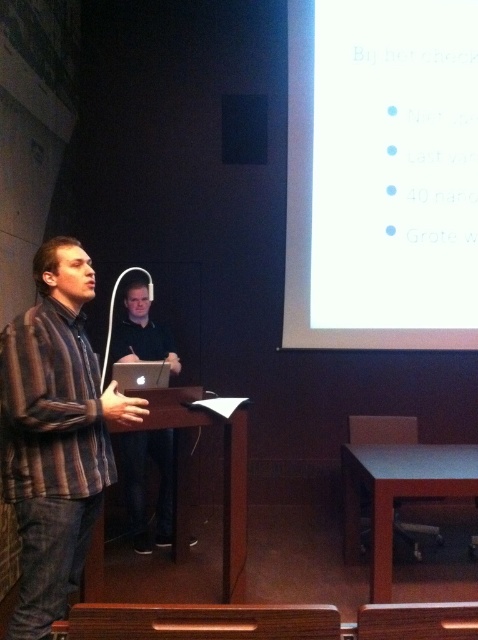
Does brown striped shirt at left have a greater height compared to matte black laptop at center?

Correct, brown striped shirt at left is much taller as matte black laptop at center.

Which is behind, point (107, 400) or point (140, 328)?

The point (140, 328) is behind.

Does point (61, 358) come closer to viewer compared to point (142, 451)?

That is True.

This screenshot has width=478, height=640. I want to click on brown striped shirt at left, so click(54, 433).

Can you confirm if white glossy projection screen at upper right is shorter than brown striped shirt at left?

No, white glossy projection screen at upper right is not shorter than brown striped shirt at left.

Is the position of white glossy projection screen at upper right more distant than that of brown striped shirt at left?

That is True.

What do you see at coordinates (381, 173) in the screenshot? The height and width of the screenshot is (640, 478). I see `white glossy projection screen at upper right` at bounding box center [381, 173].

Where is `white glossy projection screen at upper right`? The width and height of the screenshot is (478, 640). white glossy projection screen at upper right is located at coordinates (381, 173).

Does point (356, 150) come behind point (134, 292)?

That is True.

Can you confirm if white glossy projection screen at upper right is wider than matte black laptop at center?

Yes.

Between point (460, 250) and point (126, 358), which one is positioned in front?

Point (126, 358) is in front.

Locate an element on the screen. The height and width of the screenshot is (640, 478). white glossy projection screen at upper right is located at coordinates (381, 173).